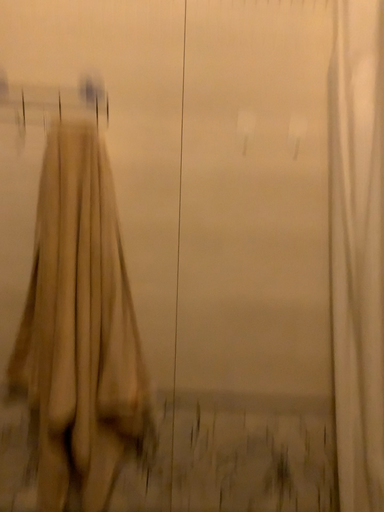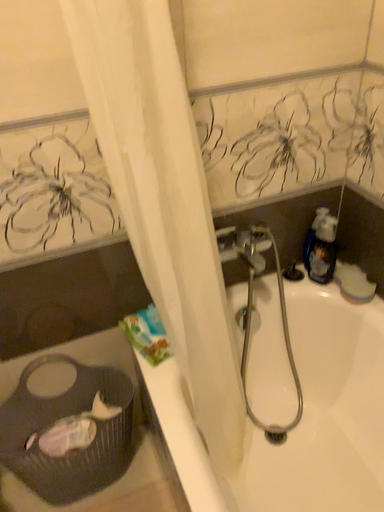
Question: How did the camera likely rotate when shooting the video?

Choices:
 (A) rotated downward
 (B) rotated upward

Answer: (A)